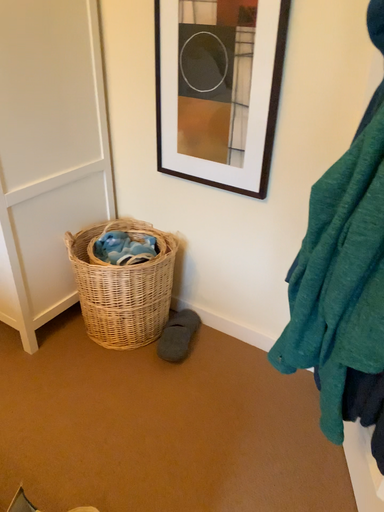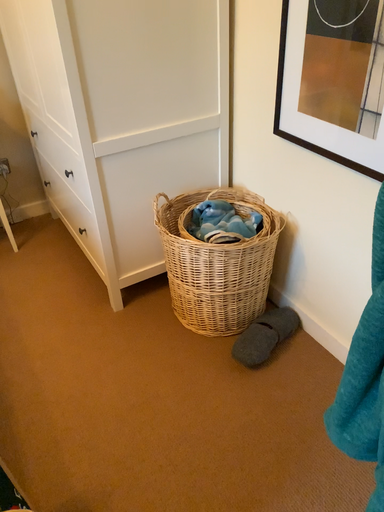
Question: How did the camera likely rotate when shooting the video?

Choices:
 (A) rotated left
 (B) rotated right

Answer: (A)